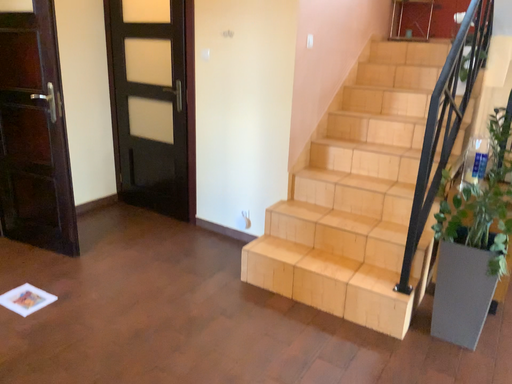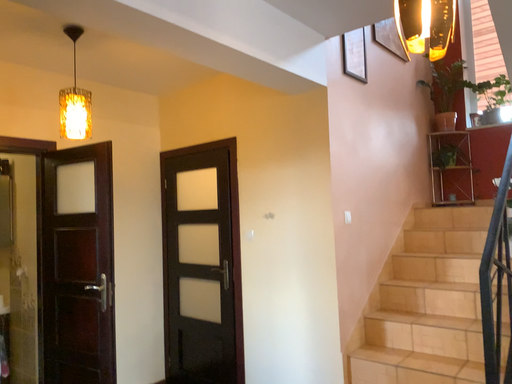
Question: How did the camera likely rotate when shooting the video?

Choices:
 (A) rotated left
 (B) rotated right

Answer: (A)